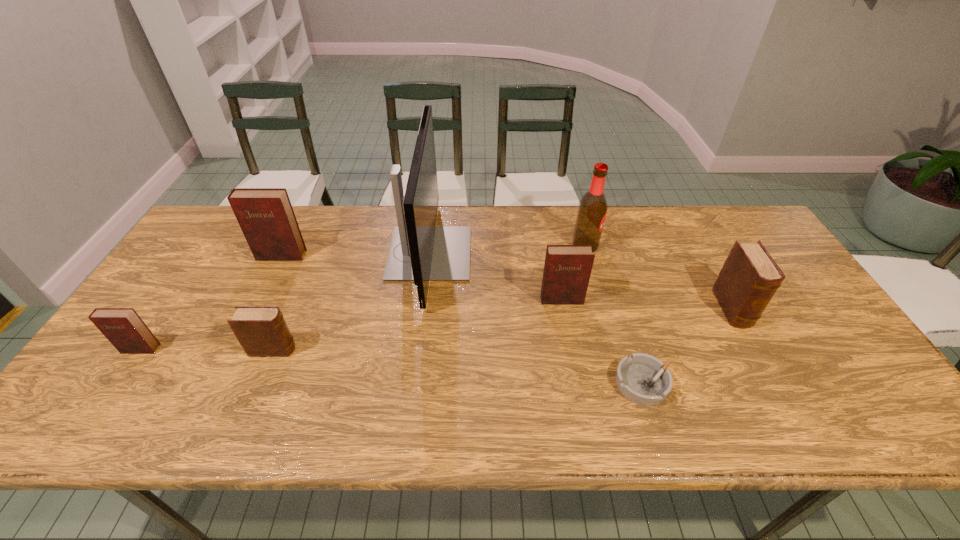
The width and height of the screenshot is (960, 540). Find the location of `vacant area between the smaller brown diary and the fourth object from right to left`. vacant area between the smaller brown diary and the fourth object from right to left is located at coordinates (418, 325).

Locate which object is the seventh closest to the seventh shortest object. Please provide its 2D coordinates. Your answer should be formatted as a tuple, i.e. [(x, y)], where the tuple contains the x and y coordinates of a point satisfying the conditions above.

[(123, 327)]

You are a GUI agent. You are given a task and a screenshot of the screen. Output one action in this format:
    pyautogui.click(x=<x>, y=<y>)
    Task: Click on the third closest object to the leftmost reddish-brown diary
    The height and width of the screenshot is (540, 960).
    Given the screenshot: What is the action you would take?
    pyautogui.click(x=420, y=251)

Find the location of a particular element. This screenshot has height=540, width=960. diary that is the closest to the farthest diary is located at coordinates (262, 331).

Where is `diary that is the fourth nearest to the fourth diary from left to right`? The width and height of the screenshot is (960, 540). diary that is the fourth nearest to the fourth diary from left to right is located at coordinates (123, 327).

Find the location of a particular element. reddish-brown diary that is the closest to the second reddish-brown diary from right to left is located at coordinates (123, 327).

At what (x,y) coordinates should I click in order to perform the action: click on reddish-brown diary that is the second nearest to the nearer brown diary. Please return your answer as a coordinate pair (x, y). The width and height of the screenshot is (960, 540). Looking at the image, I should click on (265, 215).

Find the location of `free spot that satisfies the following two spatial constraints: 1. on the screen of the fourth object from left to right; 2. on the front cover of the leftmost diary`. free spot that satisfies the following two spatial constraints: 1. on the screen of the fourth object from left to right; 2. on the front cover of the leftmost diary is located at coordinates pyautogui.click(x=418, y=349).

I want to click on vacant space that satisfies the following two spatial constraints: 1. on the screen of the computer monitor; 2. on the front cover of the biggest reddish-brown diary, so click(429, 255).

This screenshot has height=540, width=960. Identify the location of vacant space that satisfies the following two spatial constraints: 1. on the front cover of the tallest diary; 2. on the left side of the shortest object. [x=219, y=383].